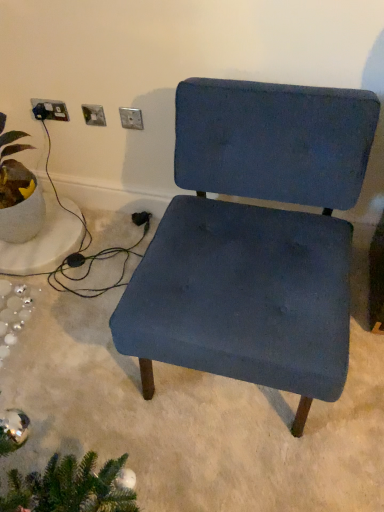
Question: Is satin silver socket at upper center, acting as the second electric outlet starting from the left, turned away from metallic silver outlet at upper center, the 1th electric outlet from the right?

Choices:
 (A) no
 (B) yes

Answer: (A)

Question: Can you confirm if satin silver socket at upper center, which appears as the second electric outlet when viewed from the right, is taller than metallic silver outlet at upper center, the 1th electric outlet from the right?

Choices:
 (A) no
 (B) yes

Answer: (A)

Question: From a real-world perspective, is satin silver socket at upper center, acting as the second electric outlet starting from the left, physically above metallic silver outlet at upper center, the third electric outlet when ordered from left to right?

Choices:
 (A) no
 (B) yes

Answer: (A)

Question: Does satin silver socket at upper center, which appears as the second electric outlet when viewed from the right, have a greater width compared to metallic silver outlet at upper center, the 1th electric outlet from the right?

Choices:
 (A) no
 (B) yes

Answer: (A)

Question: Is satin silver socket at upper center, which appears as the second electric outlet when viewed from the right, smaller than metallic silver outlet at upper center, the third electric outlet when ordered from left to right?

Choices:
 (A) no
 (B) yes

Answer: (B)

Question: Is metallic silver outlet at upper center, the 1th electric outlet from the right, located within satin silver socket at upper center, which appears as the second electric outlet when viewed from the right?

Choices:
 (A) yes
 (B) no

Answer: (B)

Question: Is metallic silver outlet at upper center, the third electric outlet when ordered from left to right, shorter than matte ceramic plant at left?

Choices:
 (A) yes
 (B) no

Answer: (A)

Question: From the image's perspective, is metallic silver outlet at upper center, the 1th electric outlet from the right, located beneath matte ceramic plant at left?

Choices:
 (A) no
 (B) yes

Answer: (A)

Question: Would you consider metallic silver outlet at upper center, the 1th electric outlet from the right, to be distant from matte ceramic plant at left?

Choices:
 (A) yes
 (B) no

Answer: (B)

Question: Is metallic silver outlet at upper center, the third electric outlet when ordered from left to right, thinner than matte ceramic plant at left?

Choices:
 (A) yes
 (B) no

Answer: (A)

Question: Is metallic silver outlet at upper center, the 1th electric outlet from the right, closer to the viewer compared to matte ceramic plant at left?

Choices:
 (A) yes
 (B) no

Answer: (B)

Question: Is metallic silver outlet at upper center, the 1th electric outlet from the right, positioned with its back to matte ceramic plant at left?

Choices:
 (A) yes
 (B) no

Answer: (B)

Question: Considering the relative sizes of matte ceramic plant at left and satin silver socket at upper center, acting as the second electric outlet starting from the left, in the image provided, is matte ceramic plant at left shorter than satin silver socket at upper center, acting as the second electric outlet starting from the left,?

Choices:
 (A) no
 (B) yes

Answer: (A)